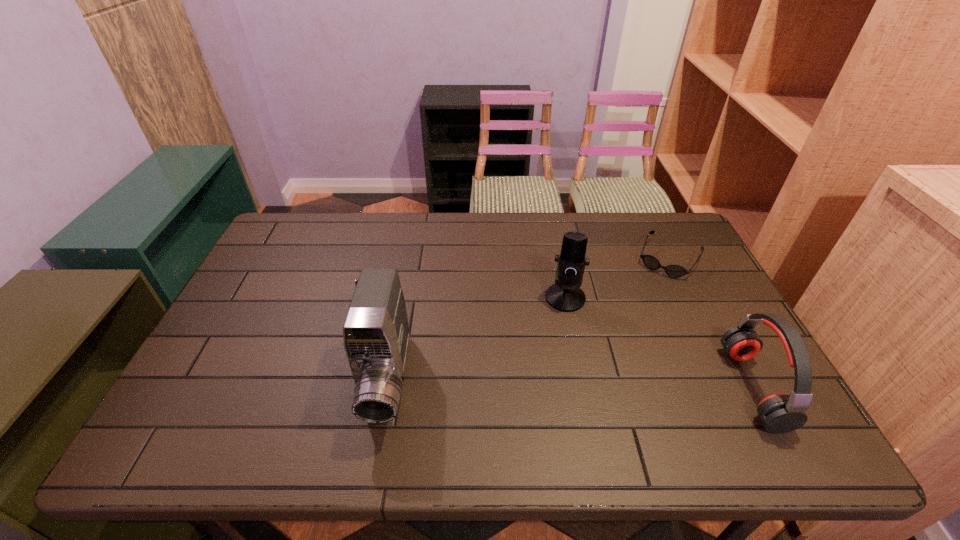
Locate an element on the screen. This screenshot has width=960, height=540. unoccupied position between the third object from right to left and the shortest object is located at coordinates pyautogui.click(x=617, y=278).

This screenshot has width=960, height=540. In order to click on vacant region between the second object from left to right and the shortest object in this screenshot , I will do `click(617, 278)`.

This screenshot has height=540, width=960. I want to click on free space between the earphone and the farthest object, so click(710, 323).

You are a GUI agent. You are given a task and a screenshot of the screen. Output one action in this format:
    pyautogui.click(x=<x>, y=<y>)
    Task: Click on the vacant space in between the shortest object and the microphone
    This screenshot has width=960, height=540.
    Given the screenshot: What is the action you would take?
    pyautogui.click(x=617, y=278)

Where is `vacant space that's between the sunglasses and the second farthest object`? This screenshot has height=540, width=960. vacant space that's between the sunglasses and the second farthest object is located at coordinates (617, 278).

Where is `vacant space that's between the microphone and the shortest object`? The width and height of the screenshot is (960, 540). vacant space that's between the microphone and the shortest object is located at coordinates (617, 278).

The height and width of the screenshot is (540, 960). In order to click on vacant area that lies between the camcorder and the earphone in this screenshot , I will do `click(570, 383)`.

Locate which object ranks third in proximity to the shortest object. Please provide its 2D coordinates. Your answer should be formatted as a tuple, i.e. [(x, y)], where the tuple contains the x and y coordinates of a point satisfying the conditions above.

[(376, 333)]

This screenshot has width=960, height=540. I want to click on the closest object to the farthest object, so click(565, 295).

Identify the location of vacant area in the image that satisfies the following two spatial constraints: 1. at the front of the earphone, highlighting the lens; 2. on the ear cups of the camcorder. The width and height of the screenshot is (960, 540). (386, 387).